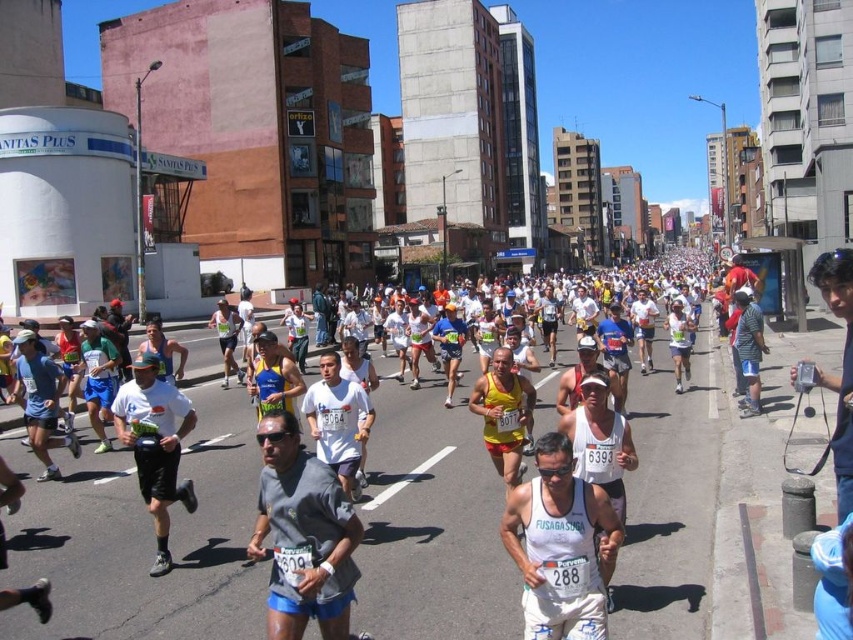
Is point (155, 412) closer to viewer compared to point (490, 435)?

Yes, it is.

Who is taller, white matte t-shirt at center or yellow matte shorts at center?

white matte t-shirt at center

Who is more distant from viewer, (177,476) or (473,406)?

Point (177,476)

Locate an element on the screen. Image resolution: width=853 pixels, height=640 pixels. white matte t-shirt at center is located at coordinates pos(155,445).

Does gray matte shirt at center have a smaller size compared to white matte t-shirt at center?

Yes.

What are the coordinates of `gray matte shirt at center` in the screenshot? It's located at (303, 536).

Can you confirm if gray matte shirt at center is positioned to the right of yellow matte shorts at center?

In fact, gray matte shirt at center is to the left of yellow matte shorts at center.

Based on the photo, is gray matte shirt at center behind yellow matte shorts at center?

No.

Is point (283, 609) closer to viewer compared to point (511, 432)?

Yes, point (283, 609) is closer to viewer.

What are the coordinates of `gray matte shirt at center` in the screenshot? It's located at (303, 536).